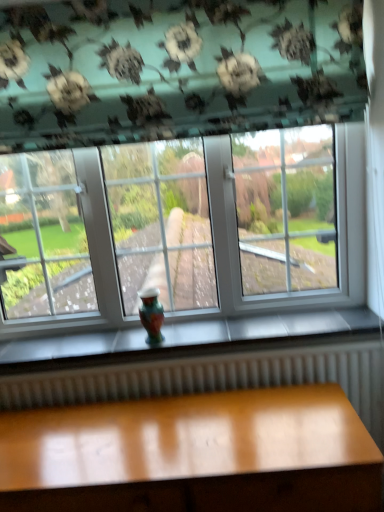
Find the location of `multicolored glass vase at center`. multicolored glass vase at center is located at coordinates (151, 314).

What do you see at coordinates (151, 314) in the screenshot? I see `multicolored glass vase at center` at bounding box center [151, 314].

Where is `glossy wood table at lower center`? This screenshot has height=512, width=384. glossy wood table at lower center is located at coordinates (194, 454).

This screenshot has height=512, width=384. What do you see at coordinates (194, 454) in the screenshot?
I see `glossy wood table at lower center` at bounding box center [194, 454].

The height and width of the screenshot is (512, 384). I want to click on multicolored glass vase at center, so click(151, 314).

Is glossy wood table at lower center at the right side of multicolored glass vase at center?

Yes, glossy wood table at lower center is to the right of multicolored glass vase at center.

Which object is closer to the camera, glossy wood table at lower center or multicolored glass vase at center?

glossy wood table at lower center is closer to the camera.

Which point is more distant from viewer, (263, 394) or (159, 305)?

The point (159, 305) is farther from the camera.

From the image's perspective, is glossy wood table at lower center located above or below multicolored glass vase at center?

From the image's perspective, glossy wood table at lower center appears below multicolored glass vase at center.

From a real-world perspective, is glossy wood table at lower center physically located above or below multicolored glass vase at center?

Clearly, from a real-world perspective, glossy wood table at lower center is below multicolored glass vase at center.

In terms of width, does glossy wood table at lower center look wider or thinner when compared to multicolored glass vase at center?

Considering their sizes, glossy wood table at lower center looks broader than multicolored glass vase at center.

Can you confirm if glossy wood table at lower center is shorter than multicolored glass vase at center?

No, glossy wood table at lower center is not shorter than multicolored glass vase at center.

Looking at this image, who is bigger, glossy wood table at lower center or multicolored glass vase at center?

glossy wood table at lower center is bigger.

Is glossy wood table at lower center situated inside multicolored glass vase at center or outside?

glossy wood table at lower center is not inside multicolored glass vase at center, it's outside.

Is glossy wood table at lower center with multicolored glass vase at center?

They are not placed beside each other.

Could you tell me if glossy wood table at lower center is facing multicolored glass vase at center?

No, glossy wood table at lower center is not oriented towards multicolored glass vase at center.

Looking at this image, measure the distance from glossy wood table at lower center to multicolored glass vase at center.

glossy wood table at lower center is 54.35 centimeters from multicolored glass vase at center.

Locate an element on the screen. This screenshot has width=384, height=512. glass vase above the glossy wood table at lower center (from the image's perspective) is located at coordinates (151, 314).

Between multicolored glass vase at center and glossy wood table at lower center, which one appears on the left side from the viewer's perspective?

multicolored glass vase at center is more to the left.

Does multicolored glass vase at center come in front of glossy wood table at lower center?

No, multicolored glass vase at center is further to the viewer.

Does point (157, 312) lie in front of point (84, 451)?

No, (157, 312) is further to viewer.

From the image's perspective, which is above, multicolored glass vase at center or glossy wood table at lower center?

multicolored glass vase at center, from the image's perspective.

From a real-world perspective, is multicolored glass vase at center located higher than glossy wood table at lower center?

Yes, from a real-world perspective, multicolored glass vase at center is over glossy wood table at lower center

Based on the photo, which of these two, multicolored glass vase at center or glossy wood table at lower center, is wider?

glossy wood table at lower center is wider.

Considering the relative sizes of multicolored glass vase at center and glossy wood table at lower center in the image provided, is multicolored glass vase at center shorter than glossy wood table at lower center?

Yes.

Considering the relative sizes of multicolored glass vase at center and glossy wood table at lower center in the image provided, is multicolored glass vase at center bigger than glossy wood table at lower center?

Actually, multicolored glass vase at center might be smaller than glossy wood table at lower center.

Is multicolored glass vase at center located outside glossy wood table at lower center?

Yes, multicolored glass vase at center is located beyond the bounds of glossy wood table at lower center.

Would you consider multicolored glass vase at center to be distant from glossy wood table at lower center?

No, multicolored glass vase at center is in close proximity to glossy wood table at lower center.

Does multicolored glass vase at center turn towards glossy wood table at lower center?

No, multicolored glass vase at center is not turned towards glossy wood table at lower center.

Looking at this image, how far apart are multicolored glass vase at center and glossy wood table at lower center?

A distance of 21.40 inches exists between multicolored glass vase at center and glossy wood table at lower center.

In the image, there is a multicolored glass vase at center. At what (x,y) coordinates should I click in order to perform the action: click on table below it (from the image's perspective). Please return your answer as a coordinate pair (x, y). Looking at the image, I should click on (194, 454).

The image size is (384, 512). I want to click on glass vase above the glossy wood table at lower center (from a real-world perspective), so click(151, 314).

The image size is (384, 512). Identify the location of glass vase behind the glossy wood table at lower center. (151, 314).